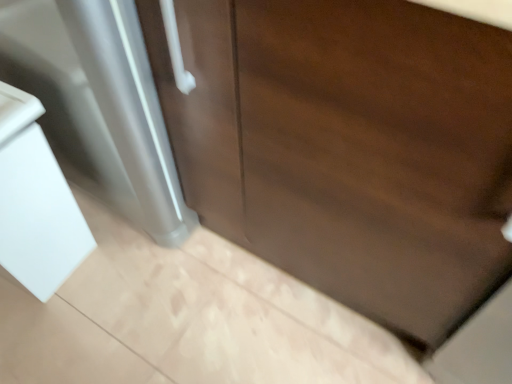
Where is `free space in front of white glossy sink at lower left`? Image resolution: width=512 pixels, height=384 pixels. free space in front of white glossy sink at lower left is located at coordinates (53, 341).